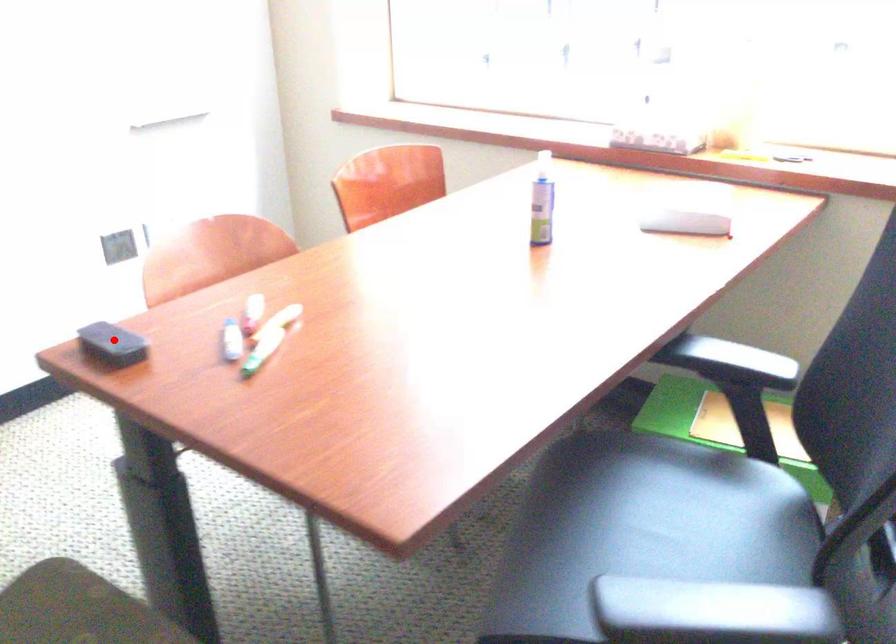
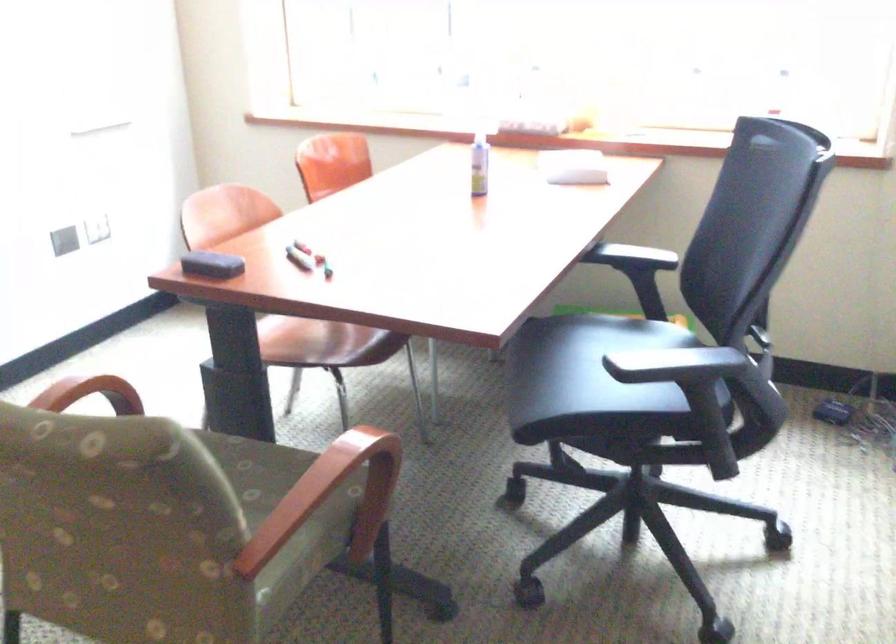
Question: I am providing you with two images of the same scene from different viewpoints. A red point is shown in image1. For the corresponding object point in image2, is it positioned nearer or farther from the camera?

Choices:
 (A) Nearer
 (B) Farther

Answer: (B)